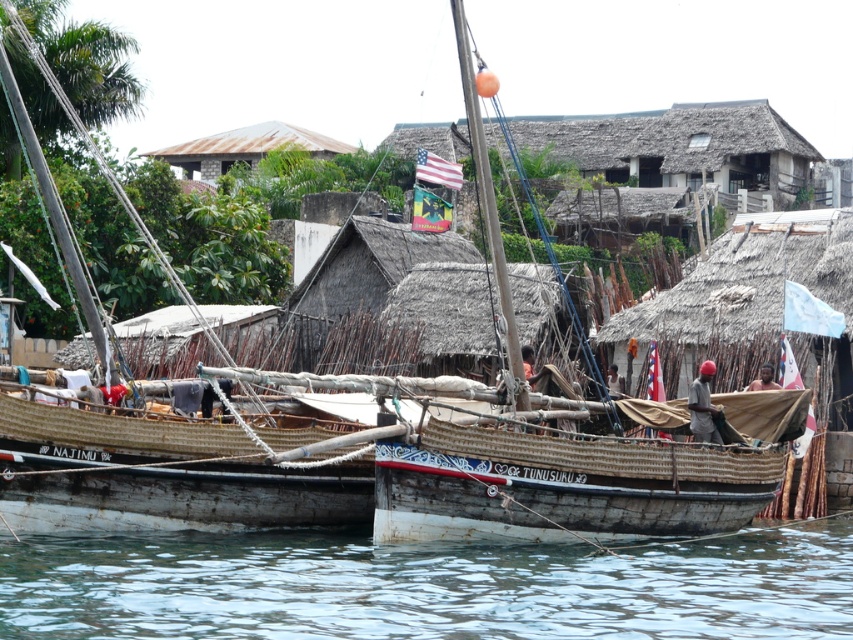
Question: From the image, what is the correct spatial relationship of clear water at lower center in relation to rusty metal roof at upper center?

Choices:
 (A) above
 (B) below

Answer: (B)

Question: Where is rusty wood boat at center located in relation to rusty metal roof at upper center in the image?

Choices:
 (A) below
 (B) above

Answer: (A)

Question: Which is nearer to the rusty metal roof at upper center?

Choices:
 (A) clear water at lower center
 (B) rusty wood boat at center

Answer: (B)

Question: Which of the following is the farthest from the observer?

Choices:
 (A) rusty metal roof at upper center
 (B) clear water at lower center
 (C) rusty wood boat at center

Answer: (A)

Question: Does clear water at lower center have a smaller size compared to rusty wood boat at center?

Choices:
 (A) yes
 (B) no

Answer: (A)

Question: Which object is farther from the camera taking this photo?

Choices:
 (A) rusty wood boat at center
 (B) rusty metal roof at upper center
 (C) clear water at lower center

Answer: (B)